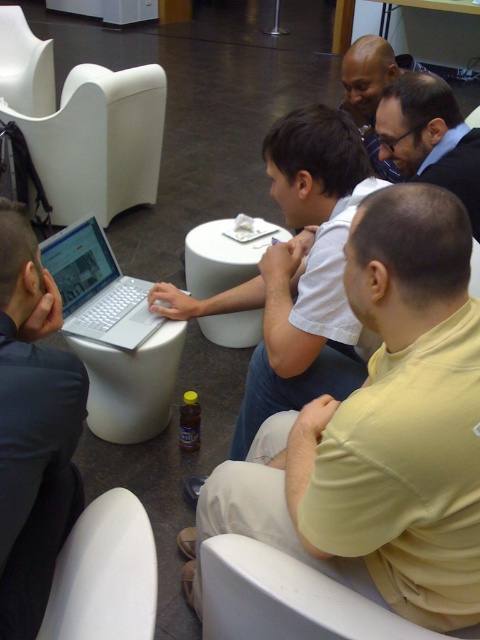
You are taking a photo of the scene and want to focus on both point (220, 550) and point (1, 86). Which point should you focus on first to ensure both are in focus?

You should focus on point (220, 550) first because it is closer to the camera than point (1, 86), allowing both points to be in focus when using depth of field.

You are sitting at the white plastic chair at lower center and want to hand a document to the person sitting at the white matte chair at upper left. Can you directly hand it over without getting up?

The white plastic chair at lower center is located below the white matte chair at upper left, which means they are positioned in different vertical levels. Therefore, you cannot directly hand the document over without getting up since they are not at the same level.